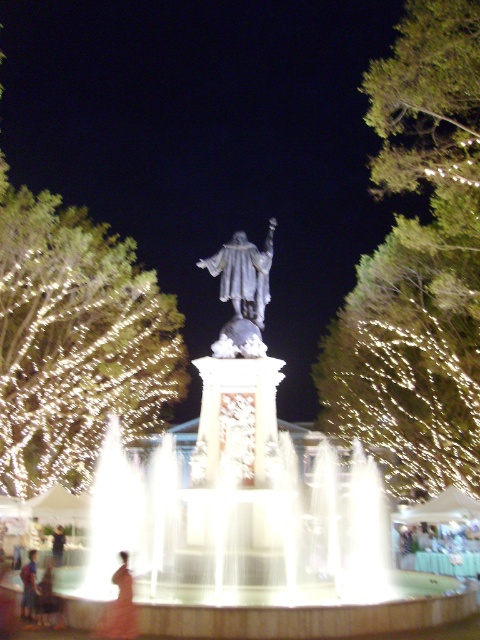
Is green leafy tree at upper right to the left of green leafy tree at left from the viewer's perspective?

In fact, green leafy tree at upper right is to the right of green leafy tree at left.

The height and width of the screenshot is (640, 480). In order to click on green leafy tree at upper right in this screenshot , I will do `click(418, 266)`.

Where is `green leafy tree at upper right`? The height and width of the screenshot is (640, 480). green leafy tree at upper right is located at coordinates (418, 266).

Is green leafy tree at left smaller than satin silver statue at center?

Incorrect, green leafy tree at left is not smaller in size than satin silver statue at center.

Which is in front, point (94, 285) or point (262, 291)?

Point (262, 291) is more forward.

Where is `green leafy tree at left`? green leafy tree at left is located at coordinates (75, 342).

Who is more forward, (442, 125) or (26, 593)?

Positioned in front is point (26, 593).

What do you see at coordinates (418, 266) in the screenshot? I see `green leafy tree at upper right` at bounding box center [418, 266].

Does point (431, 474) lie behind point (28, 580)?

That is True.

Where is `green leafy tree at upper right`? This screenshot has width=480, height=640. green leafy tree at upper right is located at coordinates (418, 266).